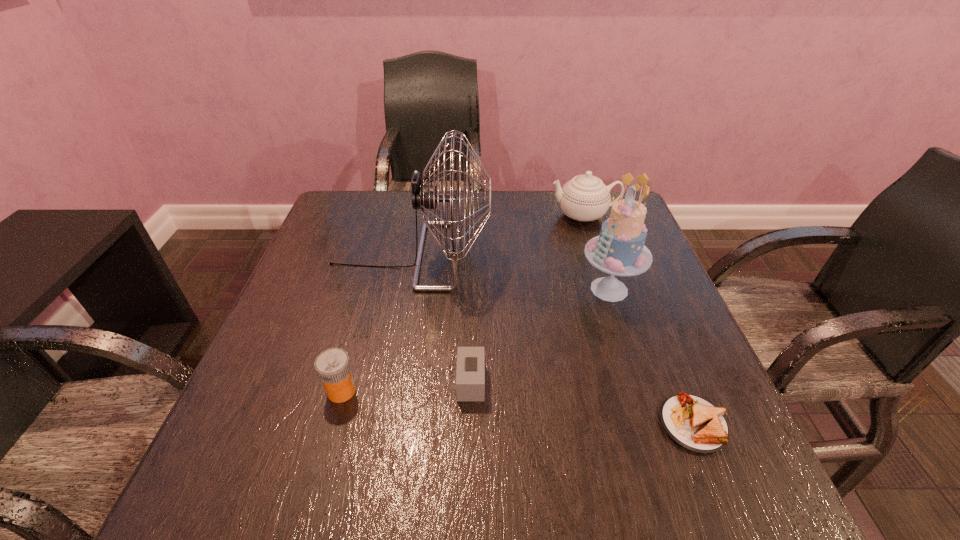
Find the location of `cake present at the right edge`. cake present at the right edge is located at coordinates (619, 250).

This screenshot has height=540, width=960. What are the coordinates of `chinaware that is at the right edge` in the screenshot? It's located at (585, 197).

Image resolution: width=960 pixels, height=540 pixels. Find the location of `sandwich that is at the right edge`. sandwich that is at the right edge is located at coordinates (693, 423).

Identify the location of object at the far left corner. pyautogui.click(x=425, y=196).

The height and width of the screenshot is (540, 960). I want to click on object that is at the far right corner, so click(585, 197).

Find the location of a particular element. The image size is (960, 540). vacant region at the far edge is located at coordinates [x=495, y=201].

Where is `free region at the near edge`? The width and height of the screenshot is (960, 540). free region at the near edge is located at coordinates (475, 480).

Find the location of a particular element. The height and width of the screenshot is (540, 960). free location at the left edge of the desktop is located at coordinates (x=235, y=444).

You are a GUI agent. You are given a task and a screenshot of the screen. Output one action in this format:
    pyautogui.click(x=<x>, y=<y>)
    Task: Click on the vacant space at the right edge of the desktop
    The height and width of the screenshot is (540, 960).
    Given the screenshot: What is the action you would take?
    pyautogui.click(x=641, y=314)

In the image, there is a desktop. Identify the location of vacant space at the far left corner. (331, 224).